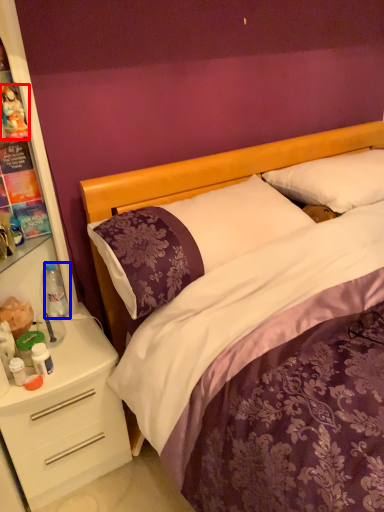
Question: Among these objects, which one is nearest to the camera, toy (highlighted by a red box) or bottle (highlighted by a blue box)?

Choices:
 (A) toy
 (B) bottle

Answer: (A)